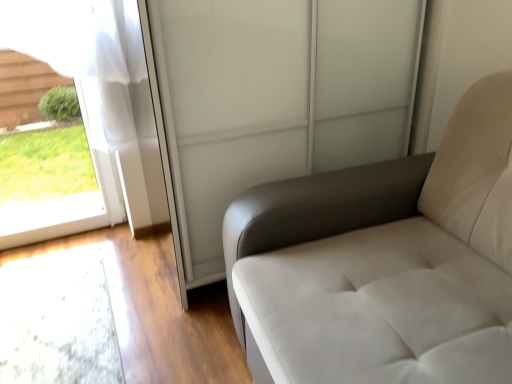
Question: Can you confirm if white leather armchair at right is bigger than transparent glass screen door at upper center?

Choices:
 (A) no
 (B) yes

Answer: (A)

Question: Would you say white leather armchair at right contains transparent glass screen door at upper center?

Choices:
 (A) yes
 (B) no

Answer: (B)

Question: Are white leather armchair at right and transparent glass screen door at upper center beside each other?

Choices:
 (A) no
 (B) yes

Answer: (A)

Question: Does white leather armchair at right appear on the right side of transparent glass screen door at upper center?

Choices:
 (A) no
 (B) yes

Answer: (B)

Question: From a real-world perspective, is white leather armchair at right physically below transparent glass screen door at upper center?

Choices:
 (A) no
 (B) yes

Answer: (B)

Question: Considering the positions of transparent glass screen door at upper center and clear glass window at left in the image, is transparent glass screen door at upper center taller or shorter than clear glass window at left?

Choices:
 (A) tall
 (B) short

Answer: (A)

Question: In the image, is transparent glass screen door at upper center on the left side or the right side of clear glass window at left?

Choices:
 (A) right
 (B) left

Answer: (A)

Question: From the image's perspective, relative to clear glass window at left, is transparent glass screen door at upper center above or below?

Choices:
 (A) below
 (B) above

Answer: (B)

Question: From a real-world perspective, is transparent glass screen door at upper center positioned above or below clear glass window at left?

Choices:
 (A) above
 (B) below

Answer: (A)

Question: Relative to transparent glass screen door at upper center, is clear glass window at left in front or behind?

Choices:
 (A) front
 (B) behind

Answer: (B)

Question: Would you say clear glass window at left is to the left or to the right of transparent glass screen door at upper center in the picture?

Choices:
 (A) left
 (B) right

Answer: (A)

Question: Does point (101, 79) appear closer or farther from the camera than point (226, 188)?

Choices:
 (A) farther
 (B) closer

Answer: (A)

Question: From a real-world perspective, is clear glass window at left positioned above or below transparent glass screen door at upper center?

Choices:
 (A) below
 (B) above

Answer: (A)

Question: Considering the positions of point (199, 13) and point (244, 200), is point (199, 13) closer or farther from the camera than point (244, 200)?

Choices:
 (A) closer
 (B) farther

Answer: (B)

Question: Considering their positions, is transparent glass screen door at upper center located in front of or behind white leather armchair at right?

Choices:
 (A) front
 (B) behind

Answer: (B)